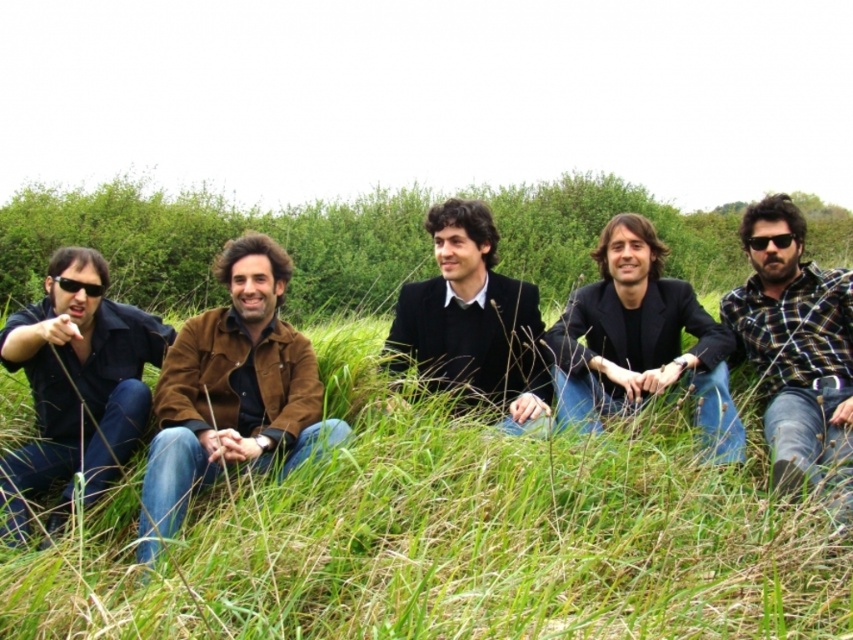
Question: Which point is closer to the camera?

Choices:
 (A) brown suede jacket at center
 (B) plaid flannel shirt at right
 (C) black matte suit at center
 (D) matte black shirt at left

Answer: (A)

Question: Can you confirm if plaid flannel shirt at right is positioned below black matte jacket at center?

Choices:
 (A) no
 (B) yes

Answer: (B)

Question: Can you confirm if black matte jacket at center is smaller than black matte suit at center?

Choices:
 (A) no
 (B) yes

Answer: (A)

Question: Which point is closer to the camera taking this photo?

Choices:
 (A) (155, 506)
 (B) (115, 419)
 (C) (508, 352)

Answer: (A)

Question: Which point is closer to the camera?

Choices:
 (A) plaid flannel shirt at right
 (B) green grassy at center

Answer: (B)

Question: Does plaid flannel shirt at right have a greater width compared to black matte suit at center?

Choices:
 (A) no
 (B) yes

Answer: (A)